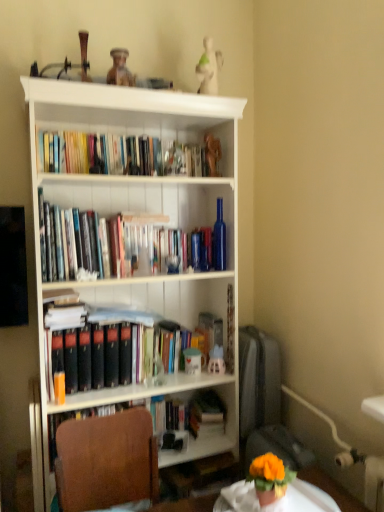
Question: Is the position of white glossy round table at lower center more distant than that of orange matte flower pot at lower right?

Choices:
 (A) no
 (B) yes

Answer: (A)

Question: Can we say white glossy round table at lower center lies outside orange matte flower pot at lower right?

Choices:
 (A) no
 (B) yes

Answer: (B)

Question: Is the surface of white glossy round table at lower center in direct contact with orange matte flower pot at lower right?

Choices:
 (A) yes
 (B) no

Answer: (A)

Question: From the image's perspective, would you say white glossy round table at lower center is shown under orange matte flower pot at lower right?

Choices:
 (A) yes
 (B) no

Answer: (A)

Question: Is white glossy round table at lower center thinner than orange matte flower pot at lower right?

Choices:
 (A) yes
 (B) no

Answer: (B)

Question: Considering the relative sizes of white glossy round table at lower center and orange matte flower pot at lower right in the image provided, is white glossy round table at lower center taller than orange matte flower pot at lower right?

Choices:
 (A) no
 (B) yes

Answer: (A)

Question: Is hardcover books at upper left positioned beyond the bounds of orange matte flower pot at lower right?

Choices:
 (A) yes
 (B) no

Answer: (A)

Question: Considering the relative sizes of hardcover books at upper left and orange matte flower pot at lower right in the image provided, is hardcover books at upper left bigger than orange matte flower pot at lower right?

Choices:
 (A) no
 (B) yes

Answer: (B)

Question: Is orange matte flower pot at lower right at the back of hardcover books at upper left?

Choices:
 (A) yes
 (B) no

Answer: (B)

Question: Does hardcover books at upper left contain orange matte flower pot at lower right?

Choices:
 (A) no
 (B) yes

Answer: (A)

Question: Is hardcover books at upper left not near orange matte flower pot at lower right?

Choices:
 (A) no
 (B) yes

Answer: (B)

Question: From a real-world perspective, is hardcover books at upper left located higher than orange matte flower pot at lower right?

Choices:
 (A) no
 (B) yes

Answer: (B)

Question: Can you confirm if white matte bookcase at center is smaller than matte orange paperback book at left?

Choices:
 (A) no
 (B) yes

Answer: (A)